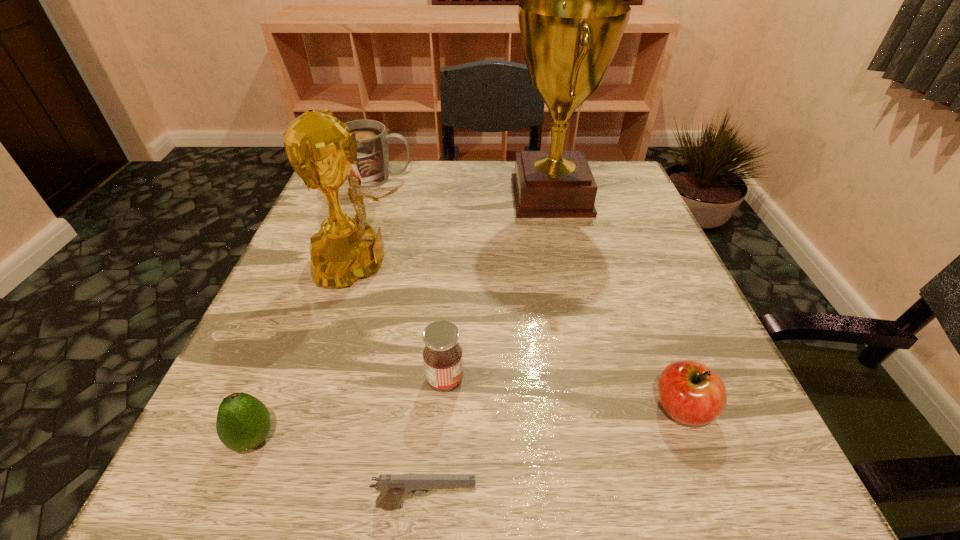
In the image, there is a desktop. What are the coordinates of `vacant space at the far edge` in the screenshot? It's located at (508, 200).

Image resolution: width=960 pixels, height=540 pixels. In order to click on free space at the near edge in this screenshot , I will do `click(455, 489)`.

Where is `vacant area at the left edge of the desktop`? Image resolution: width=960 pixels, height=540 pixels. vacant area at the left edge of the desktop is located at coordinates (308, 436).

Image resolution: width=960 pixels, height=540 pixels. Identify the location of vacant region at the right edge of the desktop. (672, 269).

Find the location of `free space at the far right corner of the desktop`. free space at the far right corner of the desktop is located at coordinates tap(619, 198).

Image resolution: width=960 pixels, height=540 pixels. Identify the location of blank space at the near right corner. (664, 475).

Locate an element on the screen. free space between the nearest object and the apple is located at coordinates (554, 456).

Locate an element on the screen. The image size is (960, 540). free space between the apple and the mug is located at coordinates (531, 293).

Locate an element on the screen. This screenshot has height=540, width=960. free spot between the avocado and the right award is located at coordinates point(402,318).

This screenshot has height=540, width=960. In order to click on vacant area that lies between the apple and the fifth shortest object in this screenshot , I will do `click(531, 293)`.